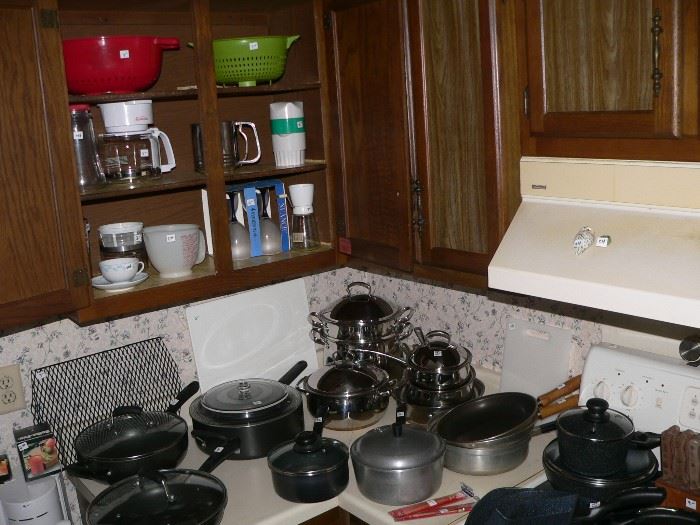
The height and width of the screenshot is (525, 700). What are the coordinates of `doors` in the screenshot? It's located at (34, 246), (391, 116), (414, 110), (437, 114), (602, 80), (690, 94).